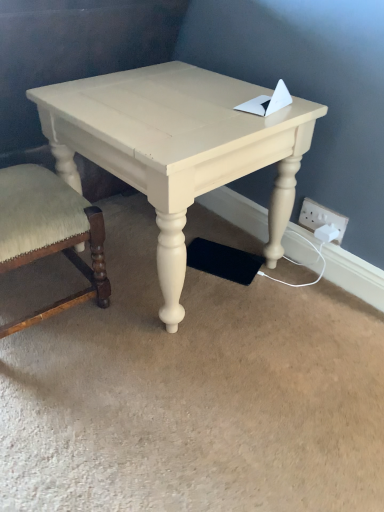
Where is `vacant space underneath velvet beige chair at lower left (from a real-world perspective)`? The width and height of the screenshot is (384, 512). vacant space underneath velvet beige chair at lower left (from a real-world perspective) is located at coordinates (33, 292).